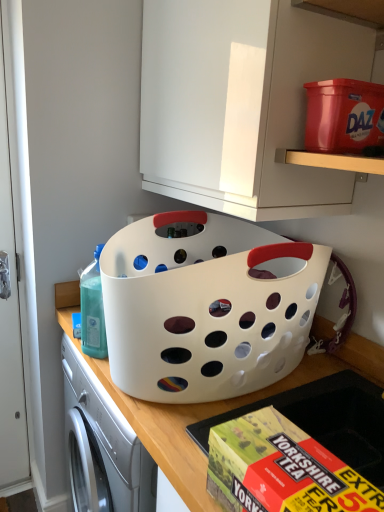
Identify the location of empty space that is ontop of yellow cardboard box at lower center (from a real-world perspective). (291, 461).